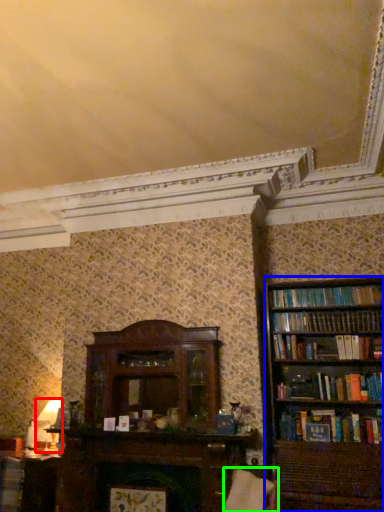
Question: Based on their relative distances, which object is farther from table lamp (highlighted by a red box)? Choose from bookcase (highlighted by a blue box) and swivel chair (highlighted by a green box).

Choices:
 (A) bookcase
 (B) swivel chair

Answer: (A)